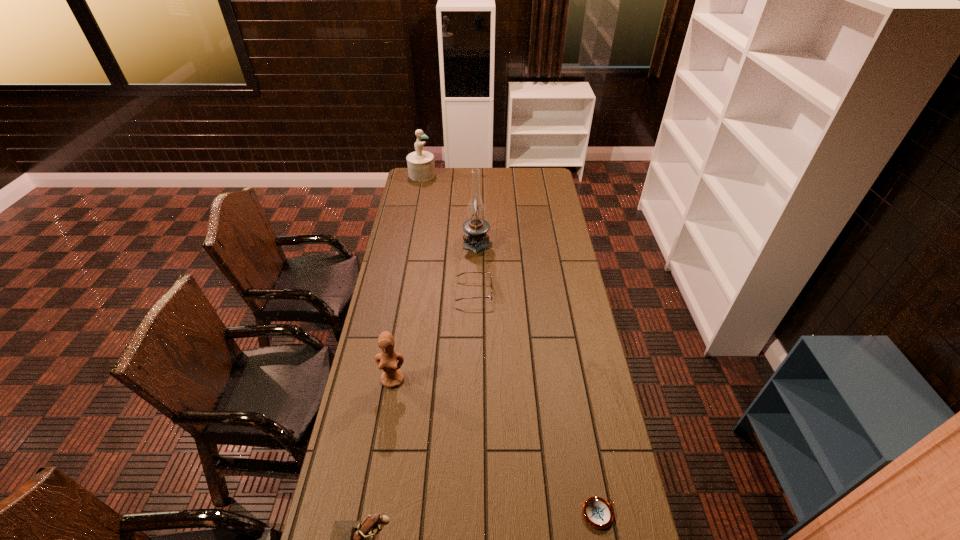
This screenshot has height=540, width=960. In the image, there is a desktop. Identify the location of vacant space at the far right corner. (547, 187).

You are a GUI agent. You are given a task and a screenshot of the screen. Output one action in this format:
    pyautogui.click(x=<x>, y=<y>)
    Task: Click on the vacant area that lies between the third nearest object and the fifth tallest object
    The width and height of the screenshot is (960, 540).
    Given the screenshot: What is the action you would take?
    pyautogui.click(x=434, y=335)

Identify the location of vacant region between the second farthest figurine and the oil lamp. (435, 310).

At what (x,y) coordinates should I click in order to perform the action: click on blank region between the third nearest object and the farthest object. Please return your answer as a coordinate pair (x, y). Looking at the image, I should click on (407, 277).

Locate an element on the screen. This screenshot has width=960, height=540. free area in between the farthest figurine and the second farthest figurine is located at coordinates (407, 277).

The image size is (960, 540). Find the location of `free space between the second shortest object and the oil lamp`. free space between the second shortest object and the oil lamp is located at coordinates (475, 267).

The width and height of the screenshot is (960, 540). I want to click on vacant space that is in between the second shortest object and the second nearest figurine, so click(x=434, y=335).

You are a GUI agent. You are given a task and a screenshot of the screen. Output one action in this format:
    pyautogui.click(x=<x>, y=<y>)
    Task: Click on the fifth closest object to the nearest figurine
    
    Given the screenshot: What is the action you would take?
    pyautogui.click(x=421, y=167)

Choose which object is the second nearest neighbor to the nearest figurine. Please provide its 2D coordinates. Your answer should be formatted as a tuple, i.e. [(x, y)], where the tuple contains the x and y coordinates of a point satisfying the conditions above.

[(598, 513)]

Identify which figurine is located as the second nearest to the nearest figurine. Please provide its 2D coordinates. Your answer should be formatted as a tuple, i.e. [(x, y)], where the tuple contains the x and y coordinates of a point satisfying the conditions above.

[(421, 167)]